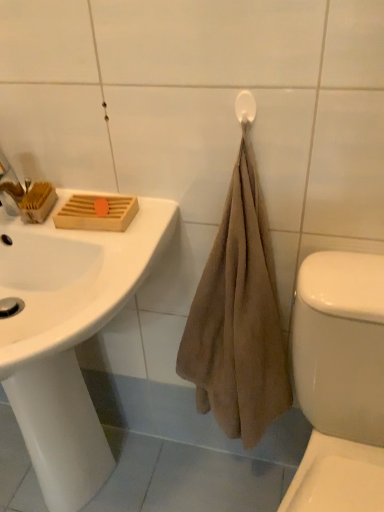
Question: Considering the relative sizes of white plastic towel bar at upper right and white glossy toilet at lower right in the image provided, is white plastic towel bar at upper right wider than white glossy toilet at lower right?

Choices:
 (A) no
 (B) yes

Answer: (A)

Question: Could you tell me if white plastic towel bar at upper right is turned towards white glossy toilet at lower right?

Choices:
 (A) no
 (B) yes

Answer: (A)

Question: Are white plastic towel bar at upper right and white glossy toilet at lower right located far from each other?

Choices:
 (A) yes
 (B) no

Answer: (B)

Question: From a real-world perspective, is white plastic towel bar at upper right located higher than white glossy toilet at lower right?

Choices:
 (A) yes
 (B) no

Answer: (A)

Question: Considering the relative positions of white plastic towel bar at upper right and white glossy toilet at lower right in the image provided, is white plastic towel bar at upper right to the left of white glossy toilet at lower right from the viewer's perspective?

Choices:
 (A) yes
 (B) no

Answer: (A)

Question: Which is correct: white glossy sink at upper left is inside white plastic towel bar at upper right, or outside of it?

Choices:
 (A) outside
 (B) inside

Answer: (A)

Question: Based on their positions, is white glossy sink at upper left located to the left or right of white plastic towel bar at upper right?

Choices:
 (A) right
 (B) left

Answer: (B)

Question: From the image's perspective, relative to white plastic towel bar at upper right, is white glossy sink at upper left above or below?

Choices:
 (A) below
 (B) above

Answer: (A)

Question: In terms of height, does white glossy sink at upper left look taller or shorter compared to white plastic towel bar at upper right?

Choices:
 (A) short
 (B) tall

Answer: (B)

Question: Considering the positions of white glossy sink at upper left and white glossy toilet at lower right in the image, is white glossy sink at upper left taller or shorter than white glossy toilet at lower right?

Choices:
 (A) short
 (B) tall

Answer: (A)

Question: Is white glossy sink at upper left wider or thinner than white glossy toilet at lower right?

Choices:
 (A) wide
 (B) thin

Answer: (A)

Question: Is white glossy sink at upper left to the left or to the right of white glossy toilet at lower right in the image?

Choices:
 (A) right
 (B) left

Answer: (B)

Question: From the image's perspective, relative to white glossy toilet at lower right, is white glossy sink at upper left above or below?

Choices:
 (A) above
 (B) below

Answer: (A)

Question: From a real-world perspective, is white glossy toilet at lower right above or below white plastic towel bar at upper right?

Choices:
 (A) below
 (B) above

Answer: (A)

Question: Is white glossy toilet at lower right inside the boundaries of white plastic towel bar at upper right, or outside?

Choices:
 (A) outside
 (B) inside

Answer: (A)